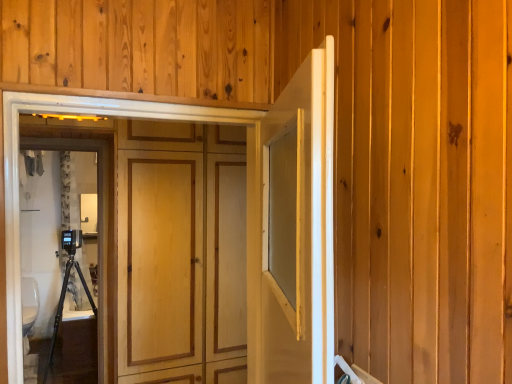
Question: From a real-world perspective, is white glossy toilet bowl at lower left above or below black plastic camera on the left?

Choices:
 (A) below
 (B) above

Answer: (A)

Question: Does point (25, 329) appear closer or farther from the camera than point (105, 158)?

Choices:
 (A) farther
 (B) closer

Answer: (B)

Question: Based on their relative distances, which object is nearer to the white glossy door at center, acting as the second door starting from the left?

Choices:
 (A) black plastic camera on the left
 (B) white glossy toilet bowl at lower left
 (C) wooden panel at center, placed as the first door when sorted from left to right

Answer: (C)

Question: Estimate the real-world distances between objects in this image. Which object is closer to the wooden panel at center, which ranks as the second door in right-to-left order?

Choices:
 (A) white glossy toilet bowl at lower left
 (B) black plastic camera on the left
 (C) white glossy door at center, positioned as the first door in right-to-left order

Answer: (C)